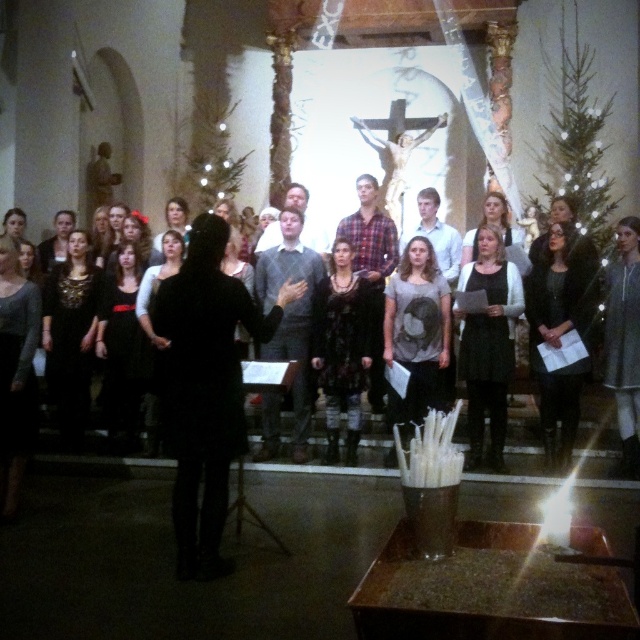
You are a photographer in the audience of the choir performance. You want to capture a photo that includes both the black dress at center and the dark gray sweater at right. Which of the two will appear smaller in the photo?

The black dress at center will appear smaller in the photo because it occupies less space than the dark gray sweater at right.

Consider the image. You are a photographer in the audience. You want to capture a photo of the black matte dress at center and the black dress at center. Which one is positioned higher in the image?

The black matte dress at center is located above the black dress at center, so it is positioned higher in the image.